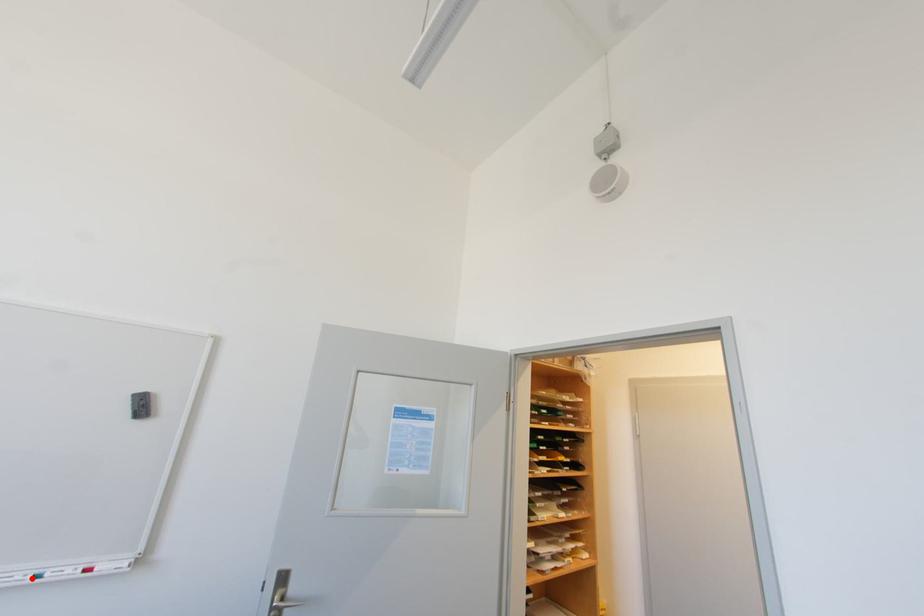
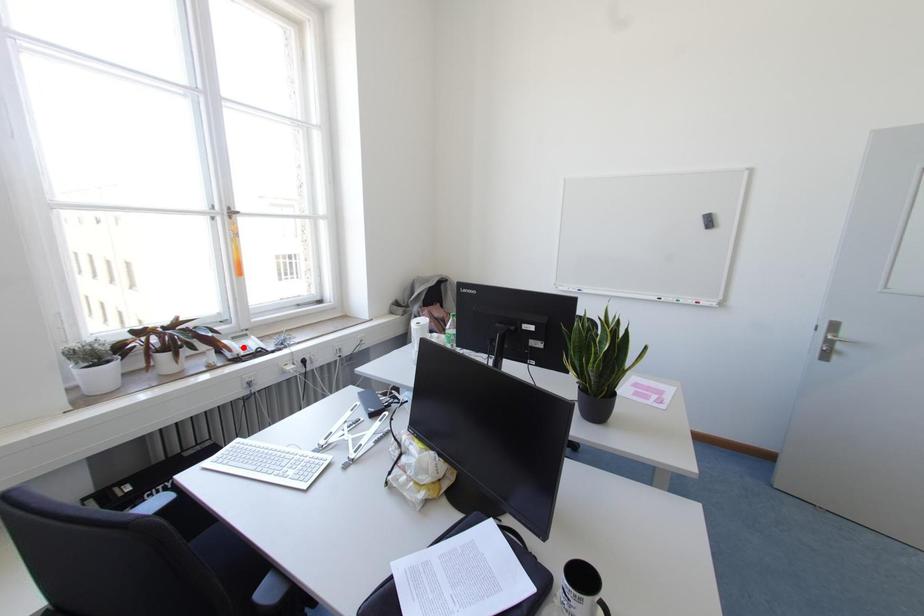
I am providing you with two images of the same scene from different viewpoints. A red point is marked on the first image and another point is marked on the second image. Are the points marked in image1 and image2 representing the same 3D position?

No